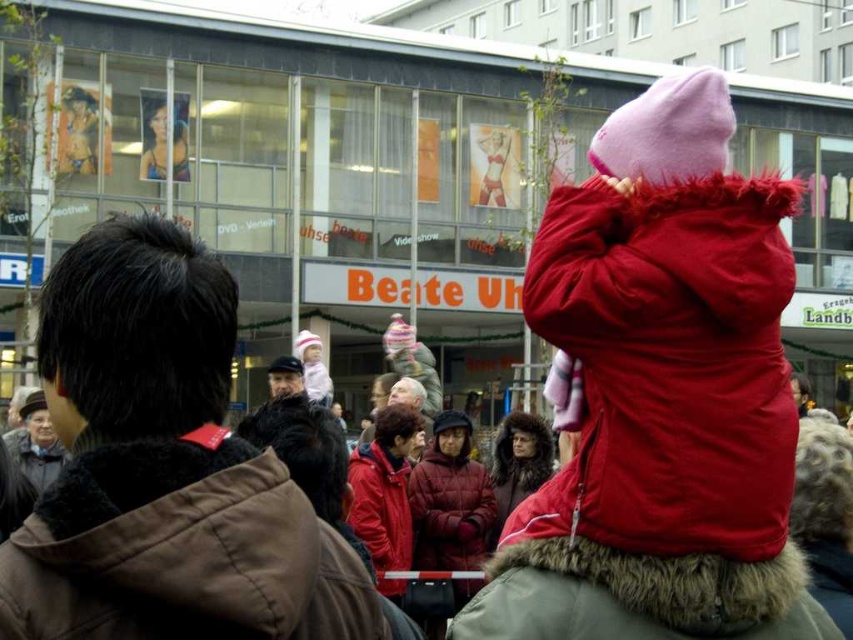
Who is more distant from viewer, (471, 566) or (537, 468)?

The point (537, 468) is behind.

Is point (450, 481) positioned in front of point (527, 440)?

That is True.

Is point (471, 428) positioned behind point (527, 412)?

No, (471, 428) is in front of (527, 412).

The width and height of the screenshot is (853, 640). What are the coordinates of `maroon puffy jacket at center` in the screenshot? It's located at (450, 499).

Does velvet red coat at upper right appear on the left side of brown fur-lined jacket at lower left?

In fact, velvet red coat at upper right is to the right of brown fur-lined jacket at lower left.

Is velvet red coat at upper right below brown fur-lined jacket at lower left?

No.

Find the location of `velvet red coat at upper right`. velvet red coat at upper right is located at coordinates (669, 364).

Find the location of a particular element. velvet red coat at upper right is located at coordinates (669, 364).

Based on the photo, who is more distant from viewer, (154, 556) or (531, 483)?

Positioned behind is point (531, 483).

Who is taller, brown fur-lined jacket at lower left or matte red fur coat at center?

With more height is brown fur-lined jacket at lower left.

Describe the element at coordinates (181, 552) in the screenshot. I see `brown fur-lined jacket at lower left` at that location.

You are a GUI agent. You are given a task and a screenshot of the screen. Output one action in this format:
    pyautogui.click(x=<x>, y=<y>)
    Task: Click on the brown fur-lined jacket at lower left
    
    Given the screenshot: What is the action you would take?
    pyautogui.click(x=181, y=552)